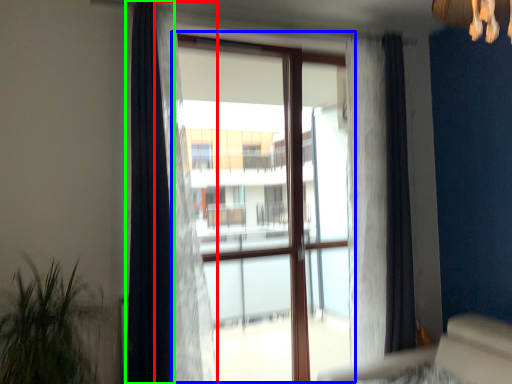
Question: Which object is positioned closest to curtain (highlighted by a red box)? Select from bay window (highlighted by a blue box) and curtain (highlighted by a green box).

Choices:
 (A) bay window
 (B) curtain

Answer: (B)